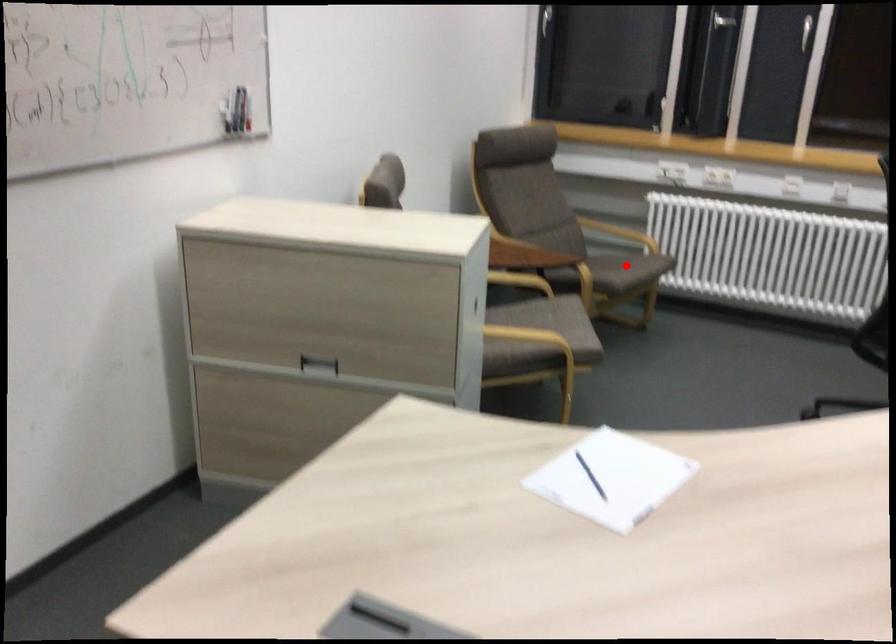
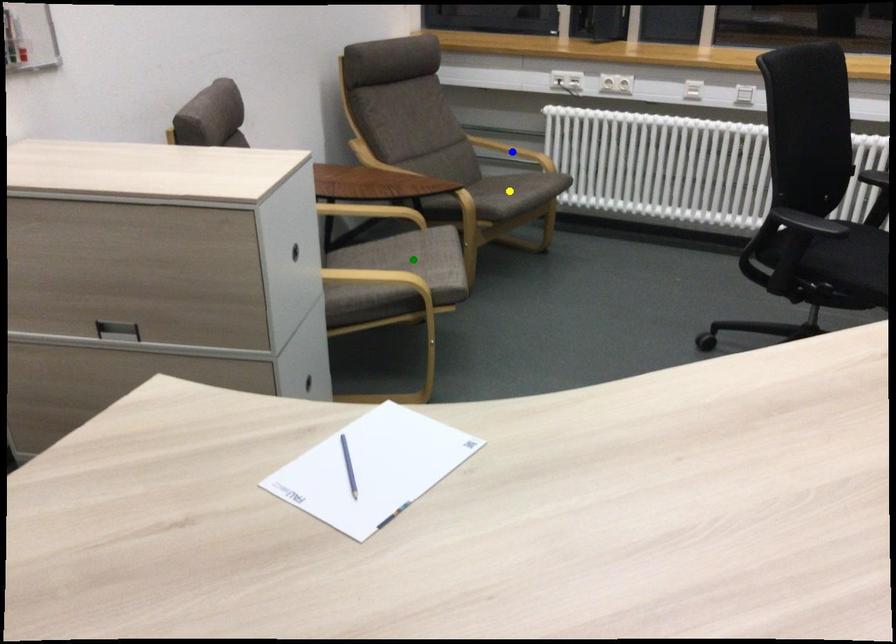
Question: I am providing you with two images of the same scene from different viewpoints. A red point is marked on the first image. You are given multiple points on the second image. Which spot in image 2 lines up with the point in image 1?

Choices:
 (A) blue point
 (B) green point
 (C) yellow point

Answer: (C)